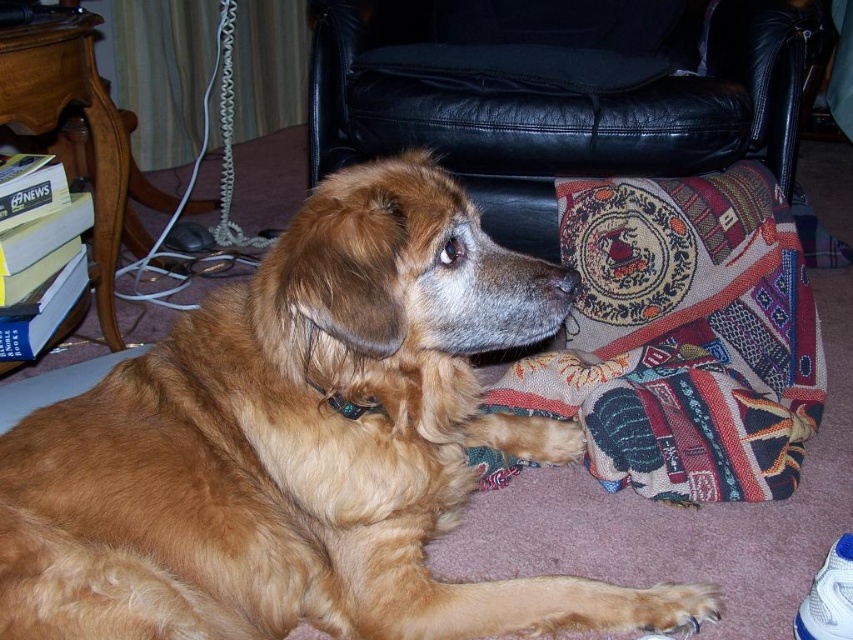
Question: Which of the following is the farthest from the observer?

Choices:
 (A) (798, 200)
 (B) (268, 256)

Answer: (A)

Question: Can you confirm if golden fur dog at center is smaller than black leather armchair at upper center?

Choices:
 (A) no
 (B) yes

Answer: (B)

Question: Does golden fur dog at center appear over black leather armchair at upper center?

Choices:
 (A) no
 (B) yes

Answer: (A)

Question: Which point is farther to the camera?

Choices:
 (A) black leather armchair at upper center
 (B) golden fur dog at center

Answer: (A)

Question: Can you confirm if golden fur dog at center is positioned to the right of black leather armchair at upper center?

Choices:
 (A) yes
 (B) no

Answer: (B)